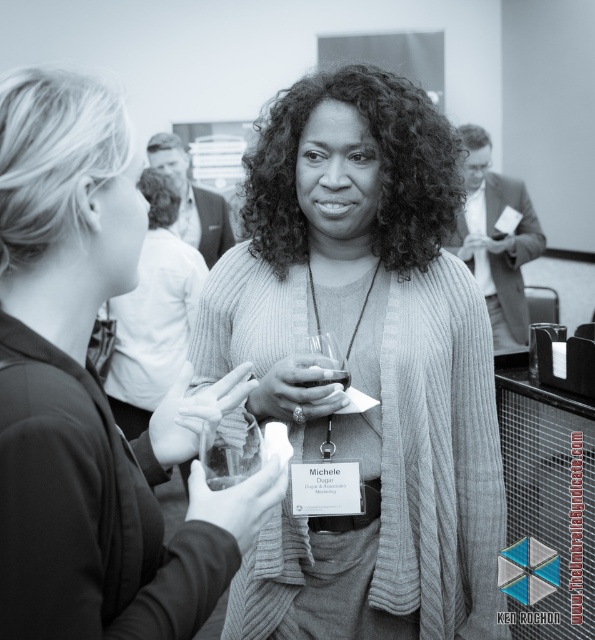
Is point (261, 436) positioned after point (317, 385)?

That is False.

Does clear glass wine glass at center have a smaller size compared to translucent glass wine at center?

Incorrect, clear glass wine glass at center is not smaller in size than translucent glass wine at center.

Consider the image. Who is more distant from viewer, (227, 464) or (315, 380)?

The point (315, 380) is behind.

Where is `clear glass wine glass at center`? clear glass wine glass at center is located at coordinates (230, 449).

Is the position of knitted sweater at center more distant than that of clear glass wine glass at center?

No.

Which is in front, point (46, 372) or point (249, 433)?

Point (46, 372) is in front.

Locate an element on the screen. The height and width of the screenshot is (640, 595). knitted sweater at center is located at coordinates (93, 394).

Who is taller, woolen cardigan at center or translucent glass wine at center?

woolen cardigan at center

Is point (231, 321) less distant than point (322, 378)?

No, (231, 321) is behind (322, 378).

Identify the location of woolen cardigan at center. (364, 364).